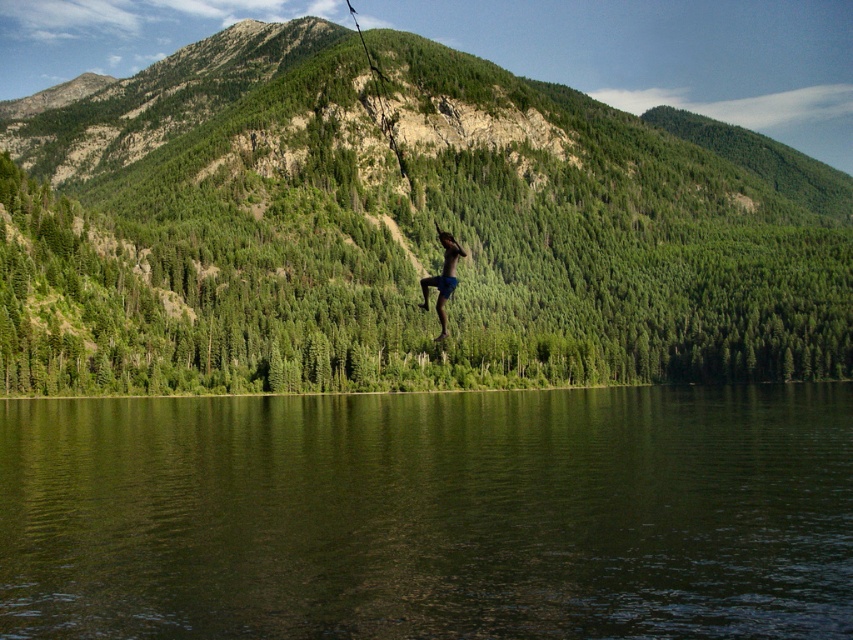
Between green smooth water at center and blue denim shorts at center, which one has less height?

With less height is green smooth water at center.

Can you confirm if green smooth water at center is smaller than blue denim shorts at center?

Incorrect, green smooth water at center is not smaller in size than blue denim shorts at center.

Find the location of a particular element. green smooth water at center is located at coordinates (430, 515).

Is point (555, 344) in front of point (445, 273)?

No, (555, 344) is further to viewer.

Does green forested mountain at center have a greater height compared to blue denim shorts at center?

Yes, green forested mountain at center is taller than blue denim shorts at center.

Find the location of a particular element. green forested mountain at center is located at coordinates (399, 228).

Locate an element on the screen. The height and width of the screenshot is (640, 853). green forested mountain at center is located at coordinates (399, 228).

Is green forested mountain at center positioned before green smooth water at center?

No, green forested mountain at center is further to the viewer.

Can you confirm if green forested mountain at center is positioned to the right of green smooth water at center?

Indeed, green forested mountain at center is positioned on the right side of green smooth water at center.

Does point (780, 324) come in front of point (479, 508)?

No, (780, 324) is behind (479, 508).

Identify the location of green forested mountain at center. tap(399, 228).